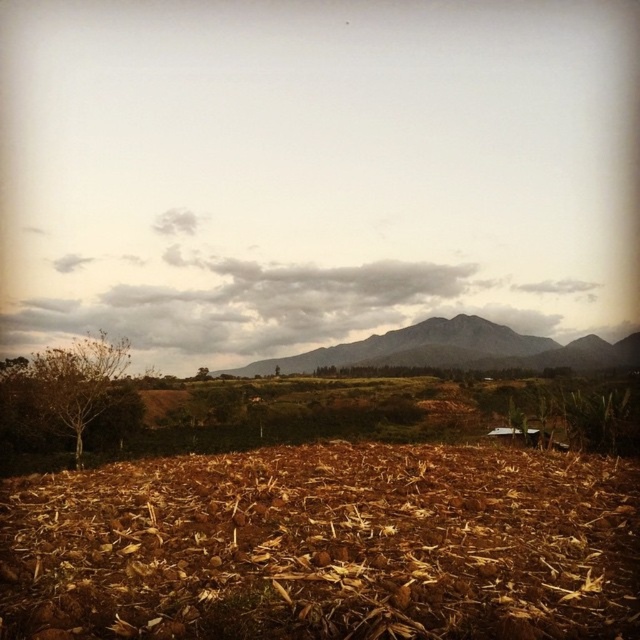
Question: Does gray rocky mountain at center have a greater width compared to green leafy tree at center?

Choices:
 (A) no
 (B) yes

Answer: (B)

Question: Which point is farther to the camera?

Choices:
 (A) green leafy tree at center
 (B) brown leafy tree at left
 (C) gray rocky mountain at center

Answer: (A)

Question: Considering the relative positions of brown leafy tree at left and gray rocky mountain at center in the image provided, where is brown leafy tree at left located with respect to gray rocky mountain at center?

Choices:
 (A) below
 (B) above

Answer: (A)

Question: Is gray rocky mountain at center positioned in front of green leafy tree at center?

Choices:
 (A) yes
 (B) no

Answer: (A)

Question: Which of the following is the closest to the observer?

Choices:
 (A) green leafy tree at center
 (B) brown leafy tree at left
 (C) gray rocky mountain at center

Answer: (B)

Question: Which of these objects is positioned closest to the green leafy tree at center?

Choices:
 (A) gray rocky mountain at center
 (B) brown leafy tree at left

Answer: (A)